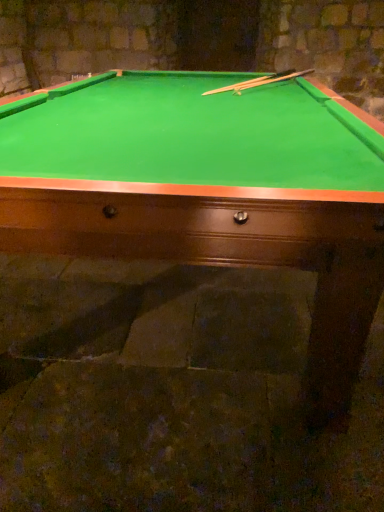
Question: Does green felt billiard table at center turn towards smooth wood cue at upper center?

Choices:
 (A) no
 (B) yes

Answer: (A)

Question: Is green felt billiard table at center positioned beyond the bounds of smooth wood cue at upper center?

Choices:
 (A) no
 (B) yes

Answer: (B)

Question: Can you confirm if green felt billiard table at center is bigger than smooth wood cue at upper center?

Choices:
 (A) yes
 (B) no

Answer: (A)

Question: Is green felt billiard table at center at the right side of smooth wood cue at upper center?

Choices:
 (A) yes
 (B) no

Answer: (B)

Question: Is green felt billiard table at center at the left side of smooth wood cue at upper center?

Choices:
 (A) yes
 (B) no

Answer: (A)

Question: From the image's perspective, is green felt billiard table at center on top of smooth wood cue at upper center?

Choices:
 (A) no
 (B) yes

Answer: (A)

Question: Is smooth wood cue at upper center to the left of green felt billiard table at center from the viewer's perspective?

Choices:
 (A) no
 (B) yes

Answer: (A)

Question: Is smooth wood cue at upper center taller than green felt billiard table at center?

Choices:
 (A) no
 (B) yes

Answer: (A)

Question: Does smooth wood cue at upper center appear on the right side of green felt billiard table at center?

Choices:
 (A) no
 (B) yes

Answer: (B)

Question: Is smooth wood cue at upper center next to green felt billiard table at center?

Choices:
 (A) yes
 (B) no

Answer: (B)

Question: Is smooth wood cue at upper center far away from green felt billiard table at center?

Choices:
 (A) yes
 (B) no

Answer: (A)

Question: Considering the relative sizes of smooth wood cue at upper center and green felt billiard table at center in the image provided, is smooth wood cue at upper center wider than green felt billiard table at center?

Choices:
 (A) yes
 (B) no

Answer: (B)

Question: Choose the correct answer: Is smooth wood cue at upper center inside green felt billiard table at center or outside it?

Choices:
 (A) outside
 (B) inside

Answer: (B)